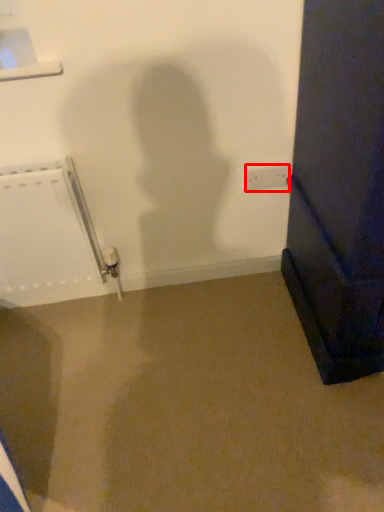
Question: From the image's perspective, where is electric outlet (annotated by the red box) located relative to radiator?

Choices:
 (A) above
 (B) below

Answer: (A)